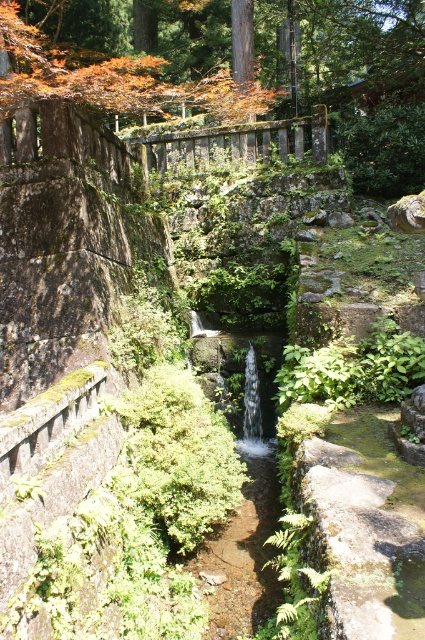
You are a bird looking for a place to perch. You see an orange leafy tree at upper left and a silver metallic waterfall at center. Which one is taller?

The orange leafy tree at upper left is taller than the silver metallic waterfall at center, so you should choose the orange leafy tree at upper left to perch on.

You are a gardener planning to plant a new bush in this garden. You have two options for locations based on the existing orange leafy tree at upper left and silver metallic waterfall at center. Which location would allow the bush to have more space to grow, considering their sizes?

The orange leafy tree at upper left has a larger size compared to the silver metallic waterfall at center, so planting the bush near the orange leafy tree at upper left would provide more space for growth.